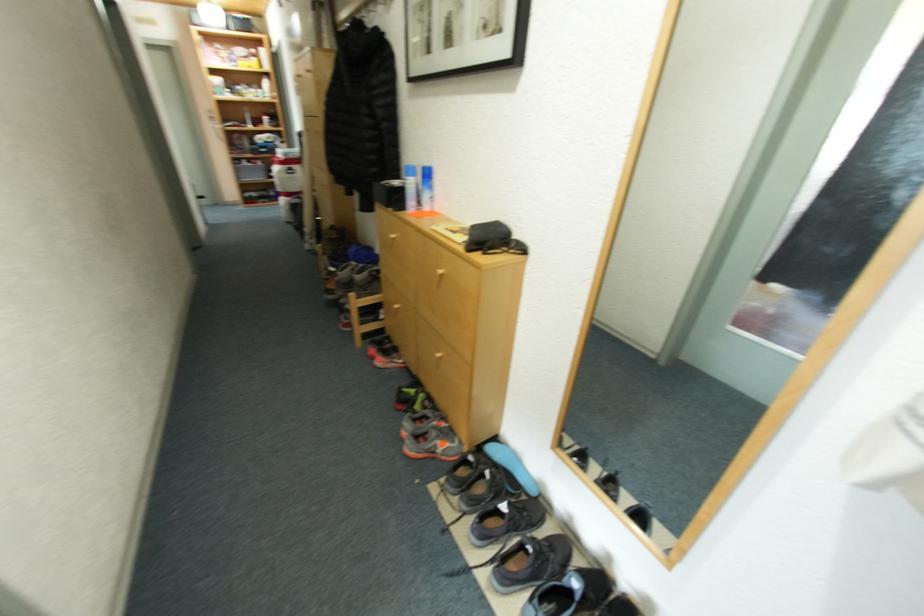
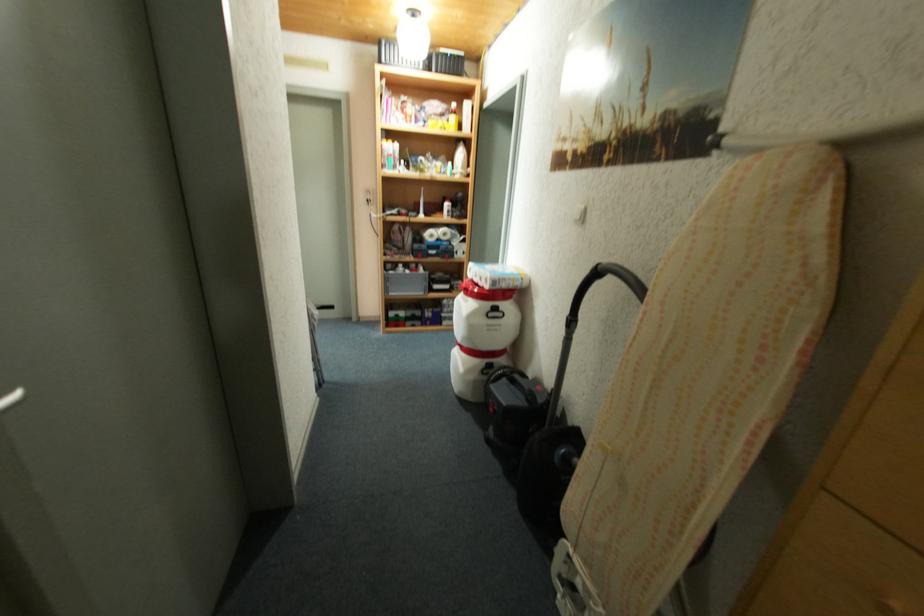
Which direction would the cameraman need to move to produce the second image?

The cameraman moved toward left, forward.